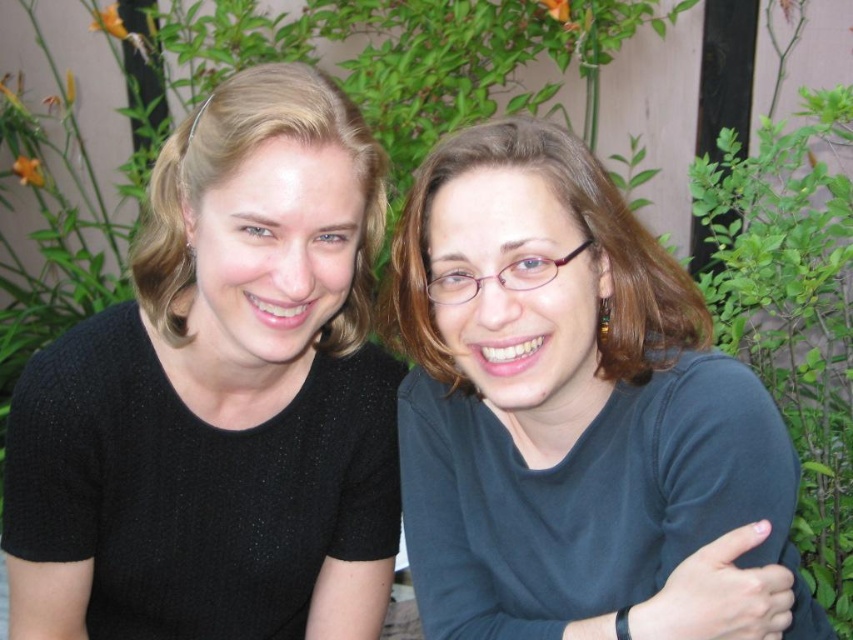
Measure the distance between black knit sweater at left and camera.

A distance of 32.57 inches exists between black knit sweater at left and camera.

Is point (184, 596) more distant than point (753, 394)?

Yes, it is behind point (753, 394).

What do you see at coordinates (219, 397) in the screenshot?
I see `black knit sweater at left` at bounding box center [219, 397].

Find the location of `black knit sweater at left`. black knit sweater at left is located at coordinates pyautogui.click(x=219, y=397).